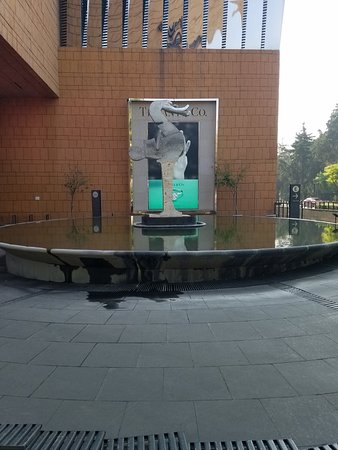
Image resolution: width=338 pixels, height=450 pixels. I want to click on tile, so click(x=232, y=412).